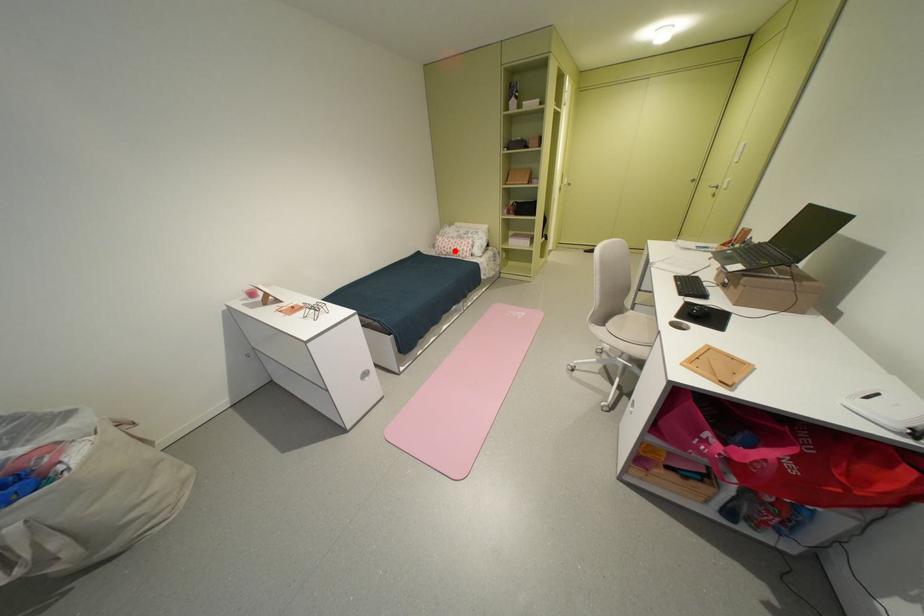
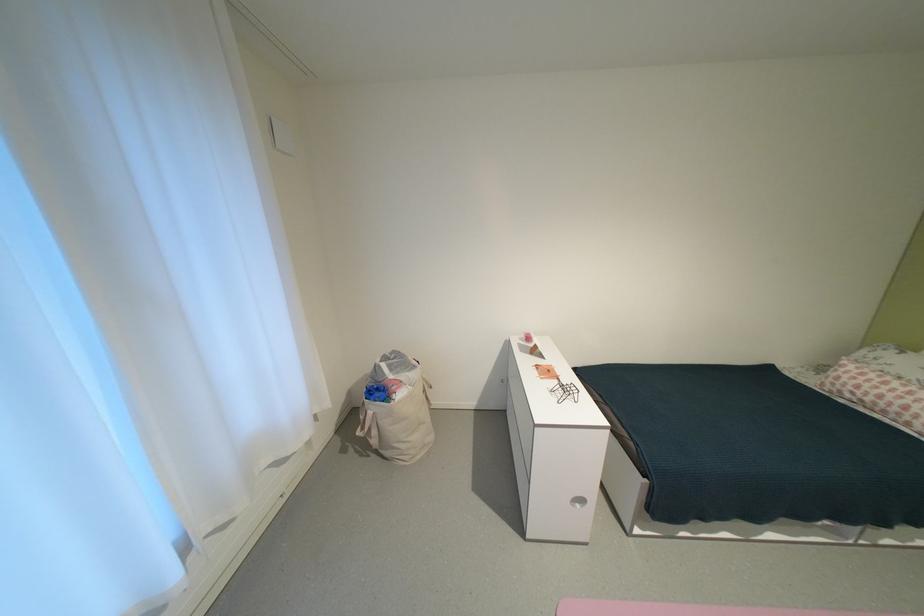
The point at the highlighted location is marked in the first image. Where is the corresponding point in the second image?

(867, 392)